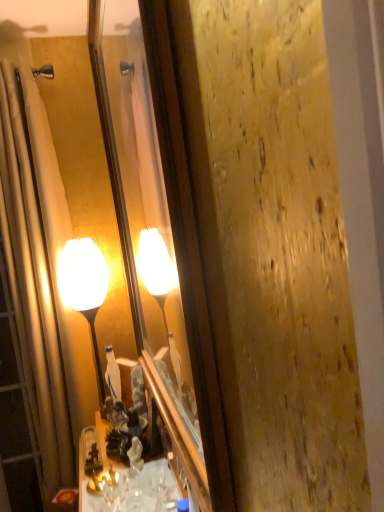
Question: Does shiny brass cabinet at lower center have a lesser height compared to matte glass lamp at center?

Choices:
 (A) no
 (B) yes

Answer: (B)

Question: Are shiny brass cabinet at lower center and matte glass lamp at center beside each other?

Choices:
 (A) yes
 (B) no

Answer: (B)

Question: Is the depth of shiny brass cabinet at lower center less than that of matte glass lamp at center?

Choices:
 (A) no
 (B) yes

Answer: (B)

Question: Is shiny brass cabinet at lower center outside matte glass lamp at center?

Choices:
 (A) yes
 (B) no

Answer: (A)

Question: Are shiny brass cabinet at lower center and matte glass lamp at center located far from each other?

Choices:
 (A) yes
 (B) no

Answer: (B)

Question: Which is correct: shiny brass cabinet at lower center is inside matte glass mirror at center, or outside of it?

Choices:
 (A) outside
 (B) inside

Answer: (A)

Question: From the image's perspective, is shiny brass cabinet at lower center above or below matte glass mirror at center?

Choices:
 (A) below
 (B) above

Answer: (A)

Question: From a real-world perspective, is shiny brass cabinet at lower center physically located above or below matte glass mirror at center?

Choices:
 (A) above
 (B) below

Answer: (B)

Question: From their relative heights in the image, would you say shiny brass cabinet at lower center is taller or shorter than matte glass mirror at center?

Choices:
 (A) tall
 (B) short

Answer: (B)

Question: Considering the relative positions of shiny brass cabinet at lower center and beige fabric shower curtain at left in the image provided, is shiny brass cabinet at lower center to the left or to the right of beige fabric shower curtain at left?

Choices:
 (A) right
 (B) left

Answer: (A)

Question: From a real-world perspective, is shiny brass cabinet at lower center positioned above or below beige fabric shower curtain at left?

Choices:
 (A) above
 (B) below

Answer: (B)

Question: Considering the positions of shiny brass cabinet at lower center and beige fabric shower curtain at left in the image, is shiny brass cabinet at lower center taller or shorter than beige fabric shower curtain at left?

Choices:
 (A) tall
 (B) short

Answer: (B)

Question: Considering the positions of shiny brass cabinet at lower center and beige fabric shower curtain at left in the image, is shiny brass cabinet at lower center wider or thinner than beige fabric shower curtain at left?

Choices:
 (A) wide
 (B) thin

Answer: (B)

Question: From their relative heights in the image, would you say matte glass mirror at center is taller or shorter than matte glass lamp at center?

Choices:
 (A) tall
 (B) short

Answer: (A)

Question: From the image's perspective, is matte glass mirror at center positioned above or below matte glass lamp at center?

Choices:
 (A) below
 (B) above

Answer: (B)